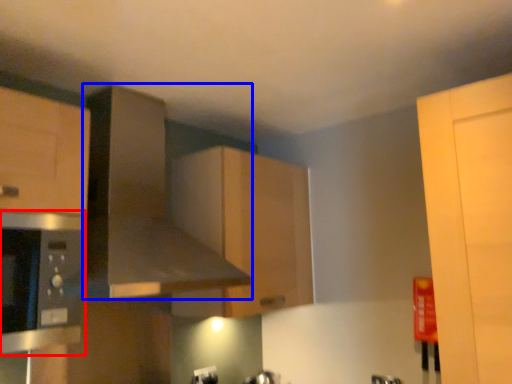
Question: Which object appears closest to the camera in this image, appliance (highlighted by a red box) or exhaust hood (highlighted by a blue box)?

Choices:
 (A) appliance
 (B) exhaust hood

Answer: (A)